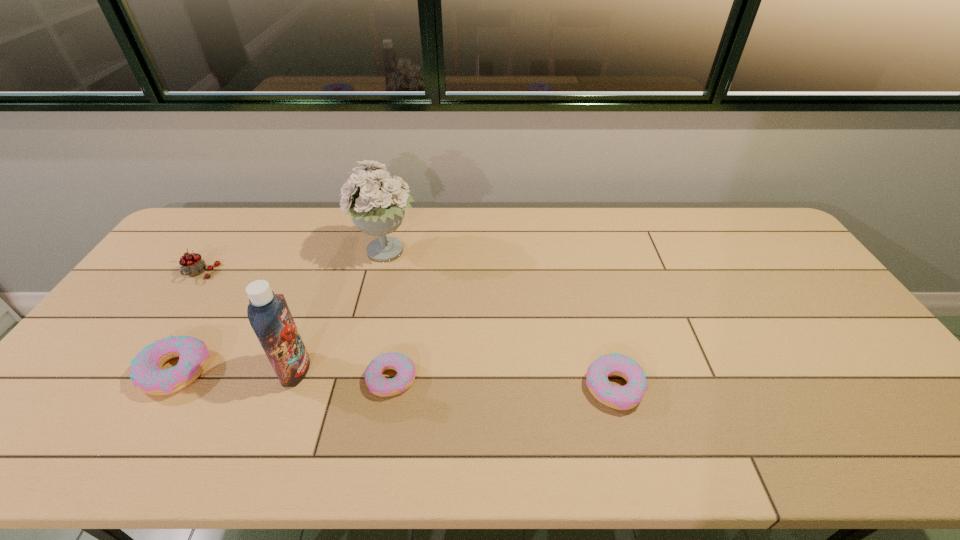
Find the location of a particular element. This screenshot has width=960, height=540. vacant space at the left edge is located at coordinates (125, 380).

I want to click on vacant space at the right edge of the desktop, so click(x=778, y=263).

Where is `free spot at the far left corner of the desktop`? free spot at the far left corner of the desktop is located at coordinates [185, 229].

Locate an element on the screen. The width and height of the screenshot is (960, 540). vacant space at the near right corner of the desktop is located at coordinates (876, 406).

Where is `vacant point located between the cherry and the leftmost doughnut`? Image resolution: width=960 pixels, height=540 pixels. vacant point located between the cherry and the leftmost doughnut is located at coordinates (188, 322).

Identify the location of free area in between the cherry and the rightmost object. This screenshot has width=960, height=540. (407, 330).

Identify the location of unoccupied area between the leftmost doughnut and the shampoo. (235, 370).

Locate an element on the screen. Image resolution: width=960 pixels, height=540 pixels. free space between the third tallest object and the fifth tallest object is located at coordinates (407, 330).

This screenshot has width=960, height=540. I want to click on free space between the second doughnut from left to right and the rightmost object, so click(503, 383).

The height and width of the screenshot is (540, 960). I want to click on vacant space in between the bouquet and the fifth tallest object, so click(500, 320).